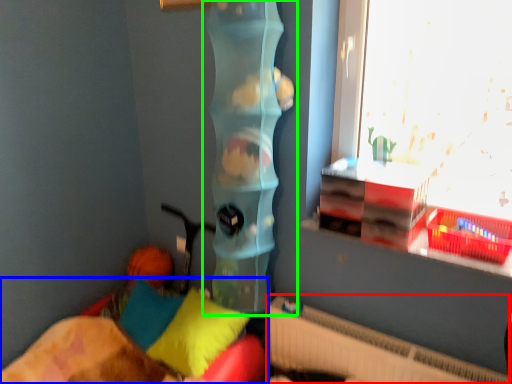
Question: Which object is positioned farthest from radiator (highlighted by a red box)? Select from furniture (highlighted by a blue box) and toy (highlighted by a green box).

Choices:
 (A) furniture
 (B) toy

Answer: (B)